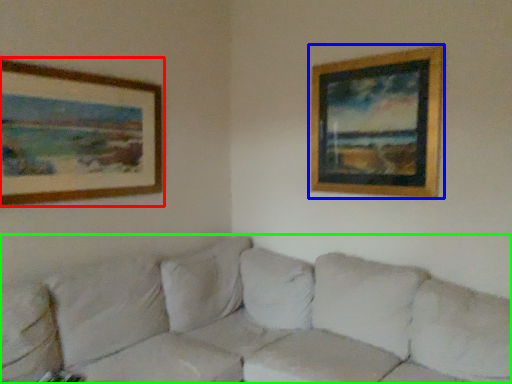
Question: Which is farther away from picture frame (highlighted by a red box)? picture frame (highlighted by a blue box) or studio couch (highlighted by a green box)?

Choices:
 (A) picture frame
 (B) studio couch

Answer: (A)